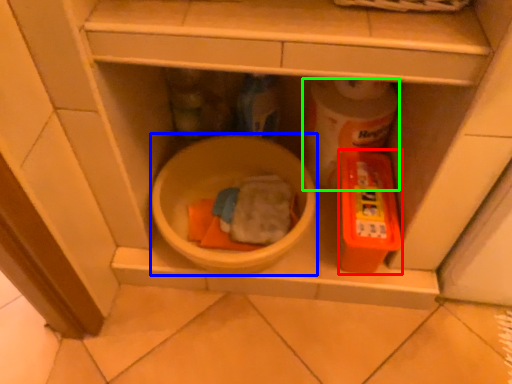
Question: Which object is positioned farthest from toy (highlighted by a red box)? Select from mixing bowl (highlighted by a blue box) and toilet paper (highlighted by a green box).

Choices:
 (A) mixing bowl
 (B) toilet paper

Answer: (A)